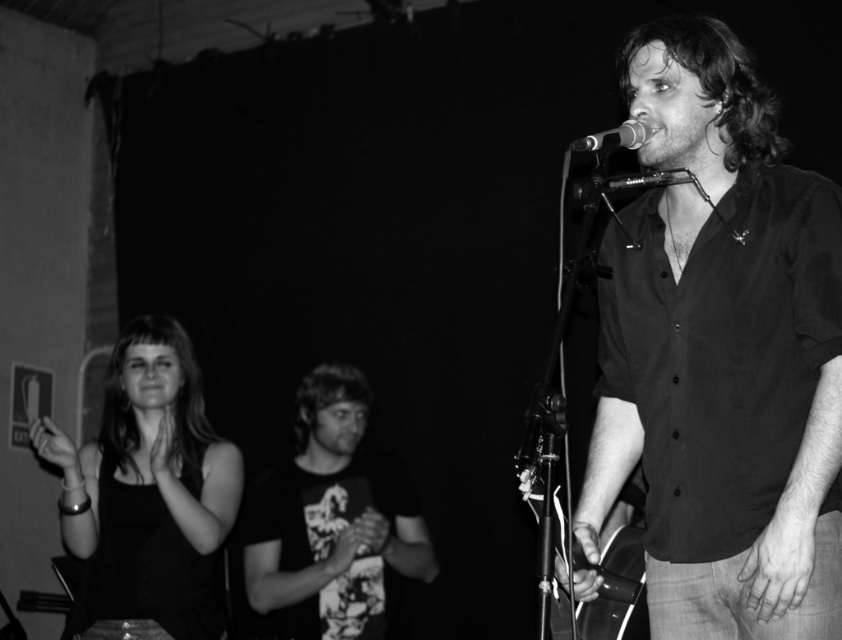
Question: Among these objects, which one is farthest from the camera?

Choices:
 (A) metallic acoustic guitar at center
 (B) black matte shirt at center

Answer: (A)

Question: Is black matte shirt at center wider than printed cotton t-shirt at center?

Choices:
 (A) no
 (B) yes

Answer: (A)

Question: Which is nearer to the metallic shiny microphone at upper center?

Choices:
 (A) metallic acoustic guitar at center
 (B) printed cotton t-shirt at center
 (C) black matte shirt at center

Answer: (C)

Question: Can you confirm if black tank top at left is wider than printed cotton t-shirt at center?

Choices:
 (A) no
 (B) yes

Answer: (A)

Question: Is black tank top at left to the right of metallic shiny microphone at upper center from the viewer's perspective?

Choices:
 (A) yes
 (B) no

Answer: (B)

Question: Among these objects, which one is farthest from the camera?

Choices:
 (A) black matte shirt at center
 (B) printed cotton t-shirt at center

Answer: (B)